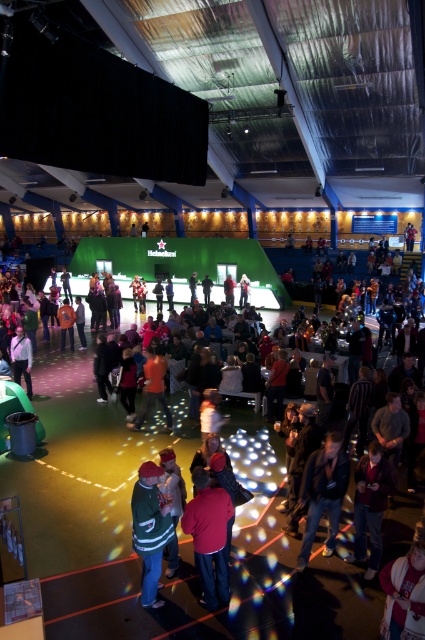
You are organizing a photo shoot in the event space and need to place two props, the green knit sweater at center and the denim jacket at lower right, on a table. Which prop should you choose if you want to use less table space?

The green knit sweater at center occupies less space than the denim jacket at lower right, so you should choose the green knit sweater at center to use less table space.

You are attending an event in the described space and notice two jackets hanging from a rack at the lower right corner. Which jacket is taller between the denim jacket at lower right and the white fleece jacket at lower right?

The denim jacket at lower right is taller than the white fleece jacket at lower right according to the description.

You are organizing a photo shoot and need to place a mannequin between the denim jacket at lower right and the white fleece jacket at lower right. The mannequin requires at least 0.5 meters of space on both sides to avoid touching the jackets. Can the mannequin be placed between them?

The denim jacket at lower right is wider than the white fleece jacket at lower right, but the question does not provide information about the distance between them. Without knowing the actual spacing between the two jackets, it is impossible to determine if there is enough room for the mannequin.